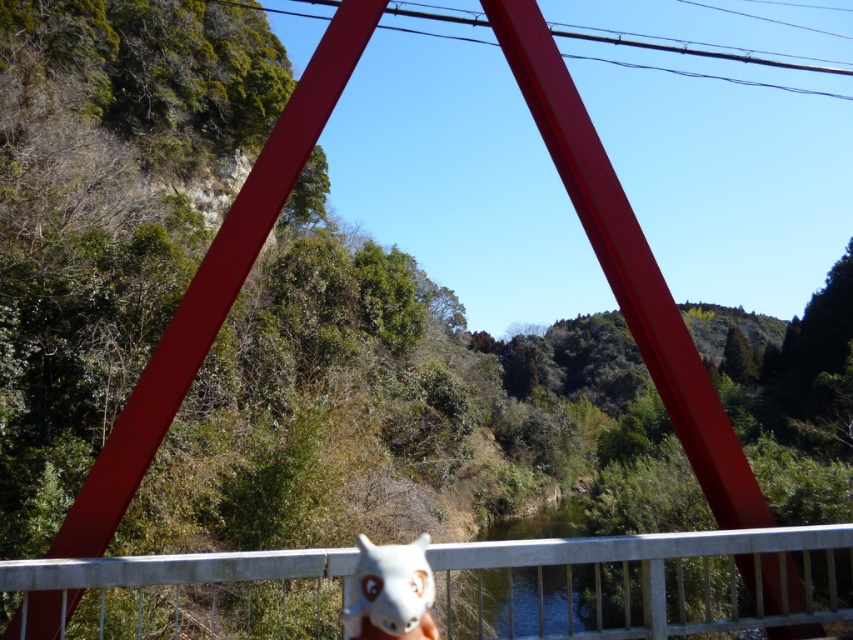
Locate an element on the screen. Image resolution: width=853 pixels, height=640 pixels. white metal rail at bottom is located at coordinates (641, 582).

Between point (683, 630) and point (567, 596), which one is positioned in front?

Point (683, 630) is more forward.

What are the coordinates of `white metal rail at bottom` in the screenshot? It's located at (641, 582).

Consider the image. Can you confirm if white metal rail at bottom is smaller than white matte animal at center?

Incorrect, white metal rail at bottom is not smaller in size than white matte animal at center.

Can you confirm if white metal rail at bottom is positioned to the right of white matte animal at center?

Indeed, white metal rail at bottom is positioned on the right side of white matte animal at center.

This screenshot has width=853, height=640. Find the location of `white metal rail at bottom`. white metal rail at bottom is located at coordinates (641, 582).

This screenshot has width=853, height=640. In order to click on white metal rail at bottom in this screenshot , I will do (x=641, y=582).

Does point (564, 566) lie in front of point (401, 595)?

No.

Is green smooth water at center above white matte animal at center?

No.

This screenshot has height=640, width=853. Find the location of `green smooth water at center`. green smooth water at center is located at coordinates (550, 598).